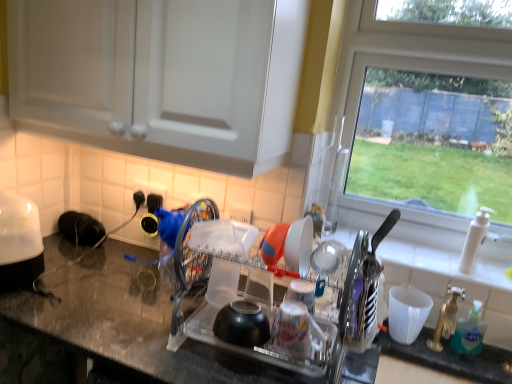
Where is `vacant space that is to the left of transparent plastic dish rack at center`? This screenshot has width=512, height=384. vacant space that is to the left of transparent plastic dish rack at center is located at coordinates (130, 327).